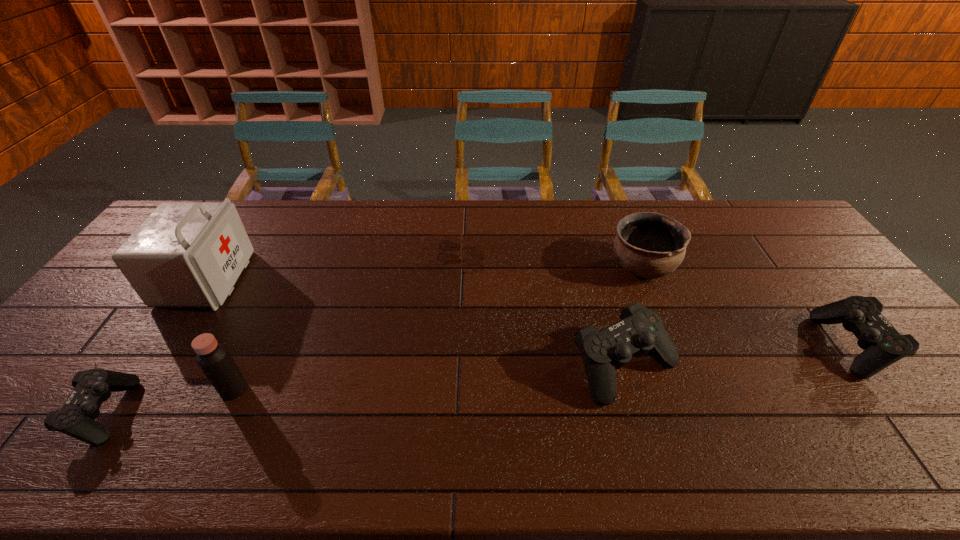
To make them evenly spaced by inserting another control among them, please locate a free space for this new control. Please provide its 2D coordinates. Your answer should be formatted as a tuple, i.e. [(x, y)], where the tuple contains the x and y coordinates of a point satisfying the conditions above.

[(375, 388)]